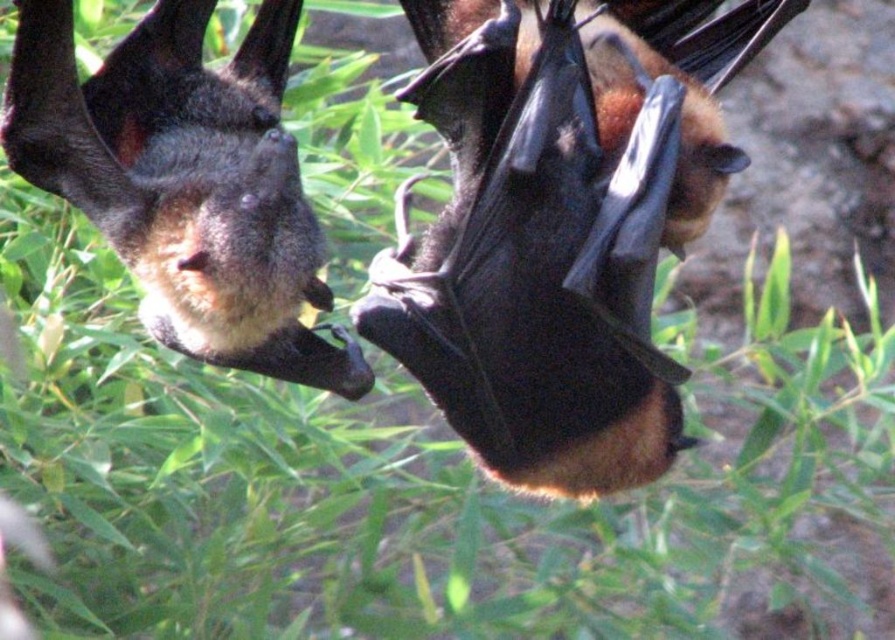
Can you confirm if brown furry bat at center is thinner than shiny brown bat at upper left?

In fact, brown furry bat at center might be wider than shiny brown bat at upper left.

Is the position of brown furry bat at center more distant than that of shiny brown bat at upper left?

That is True.

Does point (518, 266) come closer to viewer compared to point (261, 51)?

No, it is not.

Locate an element on the screen. The height and width of the screenshot is (640, 895). brown furry bat at center is located at coordinates (559, 227).